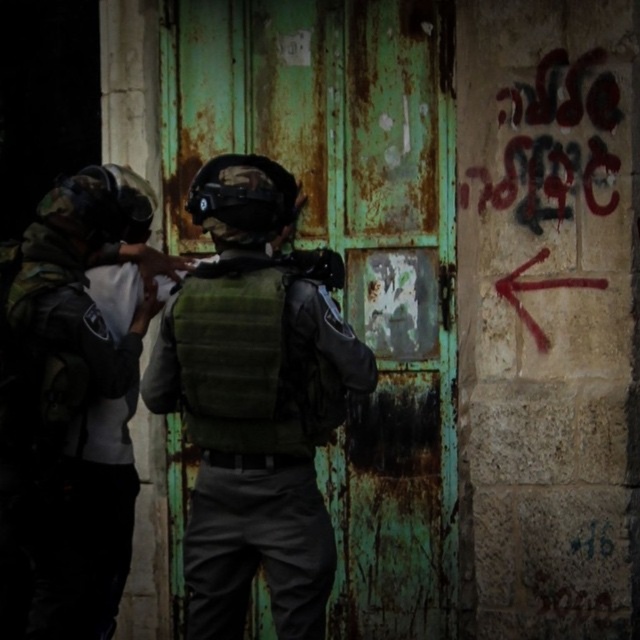
Question: Does rusty metal door at center appear over camouflage fabric helmet at left?

Choices:
 (A) yes
 (B) no

Answer: (A)

Question: Does rusty metal door at center come behind camouflage fabric helmet at left?

Choices:
 (A) yes
 (B) no

Answer: (A)

Question: Does rusty metal door at center appear over camouflage fabric helmet at left?

Choices:
 (A) yes
 (B) no

Answer: (A)

Question: Which object appears farthest from the camera in this image?

Choices:
 (A) rusty metal door at center
 (B) camouflage fabric helmet at left

Answer: (A)

Question: Which object appears closest to the camera in this image?

Choices:
 (A) camouflage fabric helmet at left
 (B) rusty metal door at center

Answer: (A)